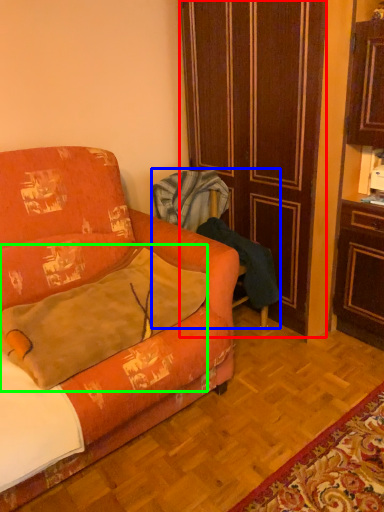
Question: Which is farther away from door (highlighted by a red box)? armchair (highlighted by a blue box) or throw pillow (highlighted by a green box)?

Choices:
 (A) armchair
 (B) throw pillow

Answer: (B)